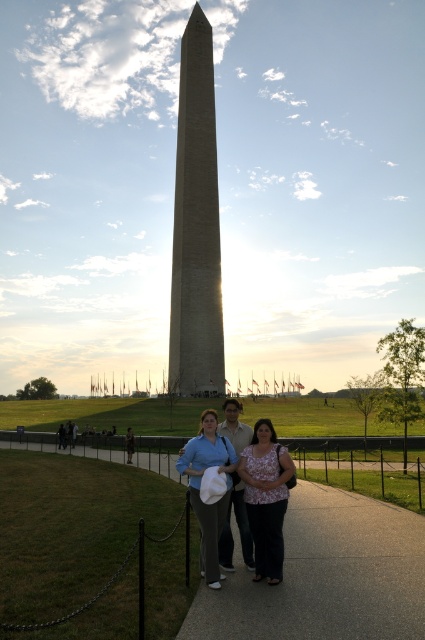
From the picture: Does matte blue shirt at center appear over smooth white shirt at center?

Incorrect, matte blue shirt at center is not positioned above smooth white shirt at center.

Does matte blue shirt at center have a greater height compared to smooth white shirt at center?

Incorrect, matte blue shirt at center's height is not larger of smooth white shirt at center's.

Is point (220, 509) closer to camera compared to point (226, 548)?

Yes, it is.

This screenshot has width=425, height=640. I want to click on matte blue shirt at center, so click(198, 490).

Which is more to the right, floral blouse at center or matte blue shirt at center?

floral blouse at center

Does point (271, 518) come farther from viewer compared to point (229, 454)?

No, it is not.

Who is more distant from viewer, (257, 442) or (197, 472)?

Positioned behind is point (257, 442).

Identify the location of floral blouse at center. This screenshot has width=425, height=640. (266, 497).

Between brown stone tower at center and floral blouse at center, which one appears on the right side from the viewer's perspective?

From the viewer's perspective, floral blouse at center appears more on the right side.

Can you confirm if brown stone tower at center is wider than floral blouse at center?

Yes.

Who is more forward, (214, 273) or (269, 509)?

Positioned in front is point (269, 509).

Identify the location of brown stone tower at center. 195,225.